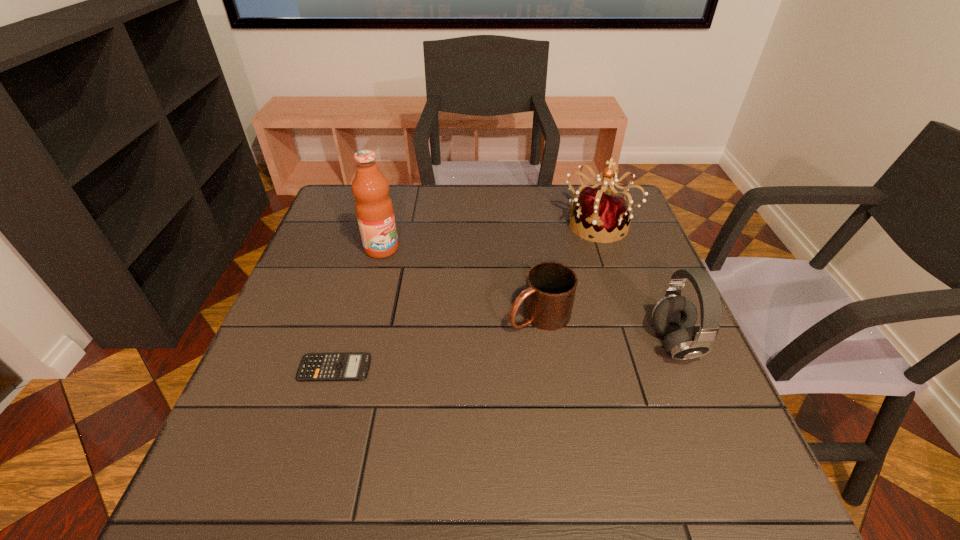
Where is `the shortest object`? the shortest object is located at coordinates (314, 366).

Find the location of a particular element. This screenshot has height=540, width=960. headset is located at coordinates (674, 316).

Where is `tiara`? tiara is located at coordinates (600, 210).

This screenshot has height=540, width=960. Find the location of `the third object from right to left`. the third object from right to left is located at coordinates (549, 294).

Locate an element on the screen. The height and width of the screenshot is (540, 960). the second shortest object is located at coordinates (549, 294).

I want to click on the tallest object, so click(374, 209).

What are the coordinates of `vacant space located on the right of the shortest object` in the screenshot? It's located at [443, 368].

You are a GUI agent. You are given a task and a screenshot of the screen. Output one action in this format:
    pyautogui.click(x=<x>, y=<y>)
    Task: Click on the vacant region located on the ear cups of the headset
    
    Given the screenshot: What is the action you would take?
    pyautogui.click(x=486, y=343)

You are a GUI agent. You are given a task and a screenshot of the screen. Output one action in this format:
    pyautogui.click(x=<x>, y=<y>)
    Task: Click on the free location located on the ear cups of the headset
    Image resolution: width=960 pixels, height=540 pixels.
    Given the screenshot: What is the action you would take?
    click(514, 343)

Where is `free location located on the ear cups of the headset`? The width and height of the screenshot is (960, 540). free location located on the ear cups of the headset is located at coordinates (591, 343).